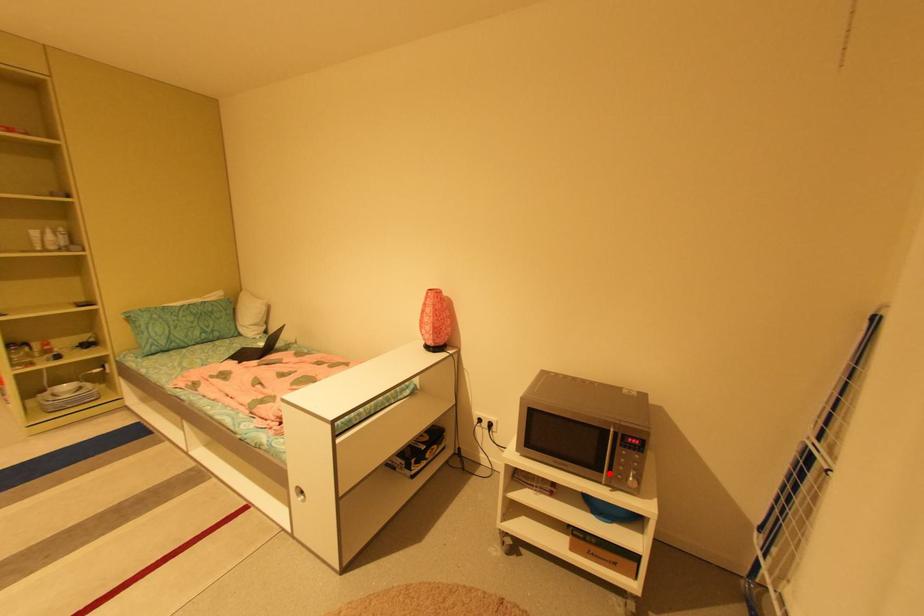
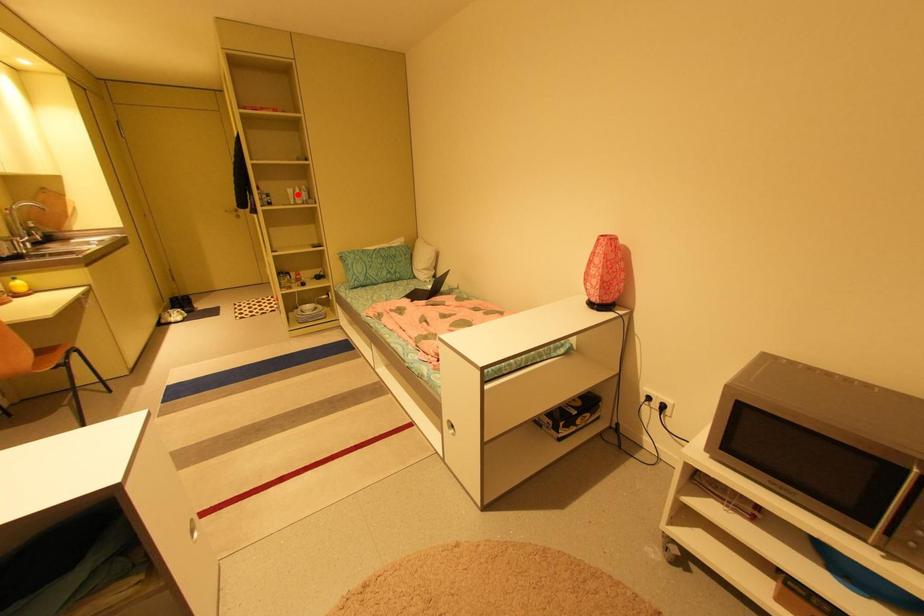
I am providing you with two images of the same scene from different viewpoints. A red point is marked on the first image and another point is marked on the second image. Do the highlighted points in image1 and image2 indicate the same real-world spot?

No